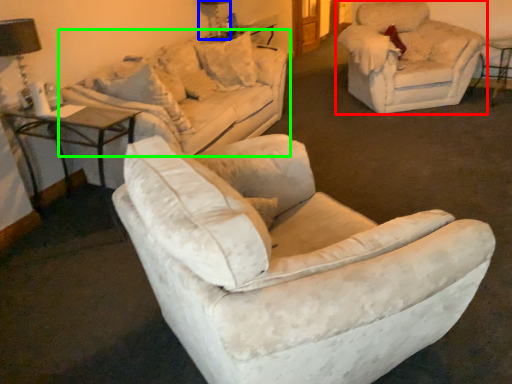
Question: Based on their relative distances, which object is farther from chair (highlighted by a red box)? Choose from table lamp (highlighted by a blue box) and studio couch (highlighted by a green box).

Choices:
 (A) table lamp
 (B) studio couch

Answer: (A)